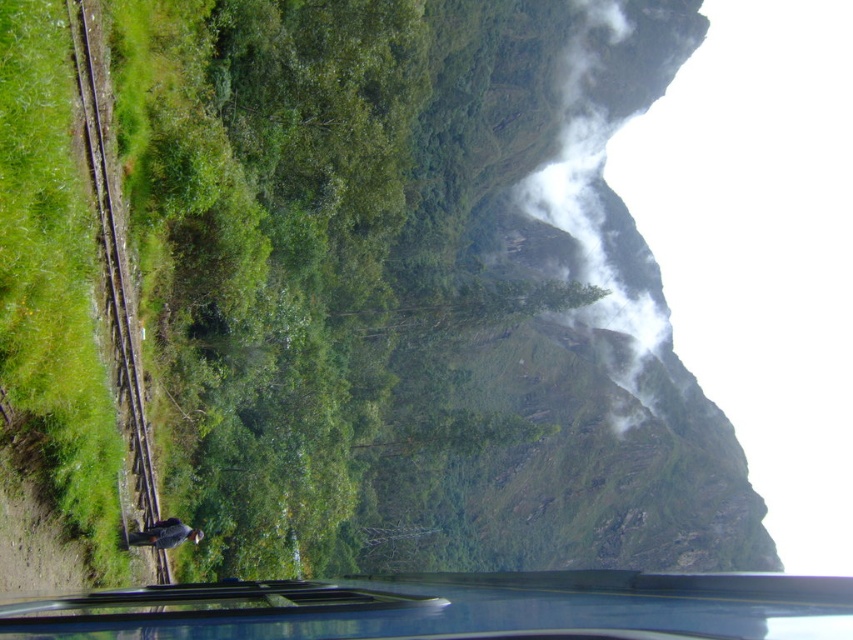
Question: In this image, where is white misty cloud at upper right located relative to brown wooden train track at left?

Choices:
 (A) above
 (B) below

Answer: (A)

Question: Which point appears closest to the camera in this image?

Choices:
 (A) (109, 220)
 (B) (546, 531)

Answer: (A)

Question: Based on their relative distances, which object is farther from the white misty cloud at upper right?

Choices:
 (A) brown wooden train track at left
 (B) green textured mountain at upper center

Answer: (A)

Question: Can you confirm if green textured mountain at upper center is positioned above transparent glass car window at lower center?

Choices:
 (A) no
 (B) yes

Answer: (A)

Question: Which point is closer to the camera?

Choices:
 (A) (662, 42)
 (B) (711, 621)

Answer: (B)

Question: Is transparent glass car window at lower center below white misty cloud at upper right?

Choices:
 (A) yes
 (B) no

Answer: (A)